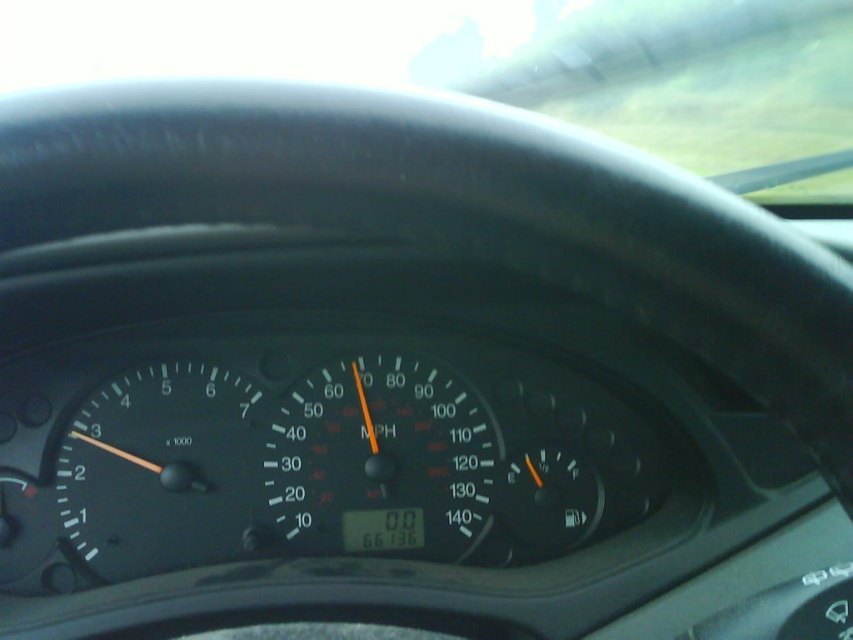
Is point (595, 20) more distant than point (433, 404)?

Yes.

Between transparent glass windshield at upper center and black plastic speedometer at center, which one has less height?

black plastic speedometer at center

Identify the location of transparent glass windshield at upper center. The image size is (853, 640). (498, 60).